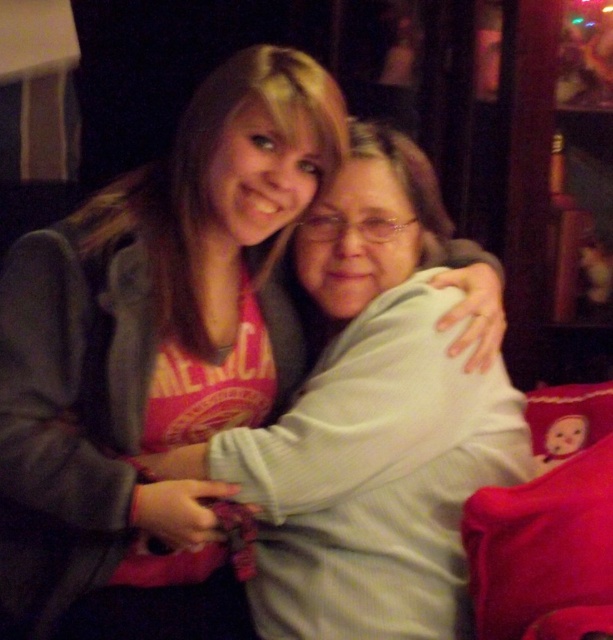
The image size is (613, 640). Describe the element at coordinates (544, 552) in the screenshot. I see `red plush pillow at lower right` at that location.

Which of these two, red plush pillow at lower right or velvet plush pillow at upper right, stands shorter?

Standing shorter between the two is velvet plush pillow at upper right.

Between point (497, 509) and point (531, 408), which one is positioned behind?

The point (531, 408) is behind.

Locate an element on the screen. The height and width of the screenshot is (640, 613). red plush pillow at lower right is located at coordinates (544, 552).